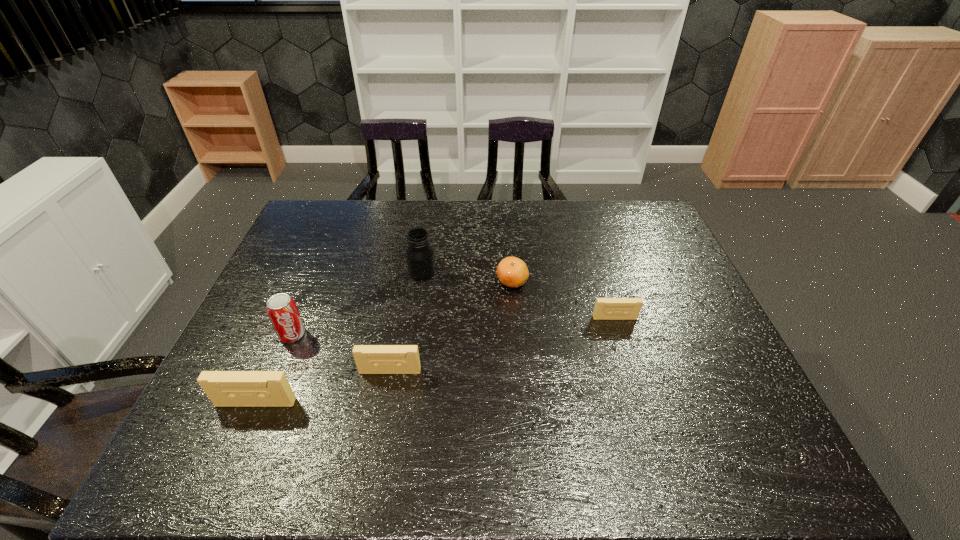
Locate an element on the screen. The image size is (960, 540). empty location between the fifth object from left to right and the farthest videotape is located at coordinates (564, 300).

Where is `vacant space that is in between the soda can and the second tallest videotape`? This screenshot has width=960, height=540. vacant space that is in between the soda can and the second tallest videotape is located at coordinates (341, 353).

Where is `vacant area between the fifth farthest object and the jar`? vacant area between the fifth farthest object and the jar is located at coordinates (406, 321).

Locate which object is the third closest to the fourth nearest object. Please provide its 2D coordinates. Your answer should be formatted as a tuple, i.e. [(x, y)], where the tuple contains the x and y coordinates of a point satisfying the conditions above.

[(370, 359)]

In order to click on object that is the second closest to the second nearest object in this screenshot , I will do `click(281, 308)`.

Locate an element on the screen. The width and height of the screenshot is (960, 540). the closest videotape to the second object from right to left is located at coordinates [605, 308].

Where is `the closest videotape to the nearest videotape`? the closest videotape to the nearest videotape is located at coordinates (370, 359).